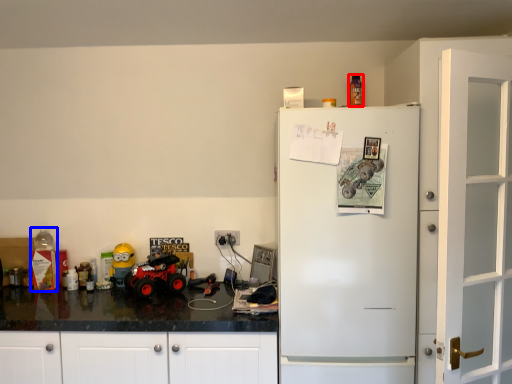
Question: Which point is closer to the camera, toy (highlighted by a red box) or toy (highlighted by a blue box)?

Choices:
 (A) toy
 (B) toy

Answer: (A)